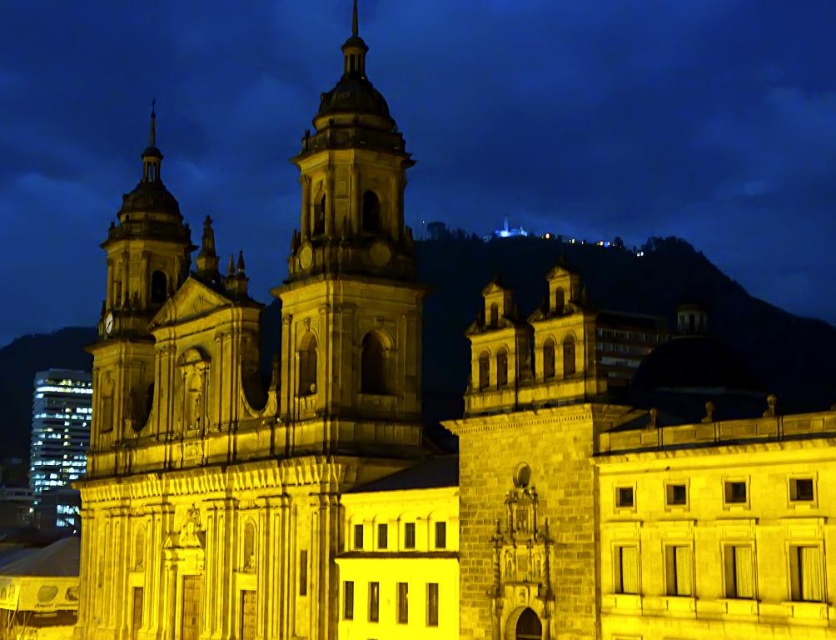
Question: Which point is closer to the camera?

Choices:
 (A) (317, 378)
 (B) (136, 291)

Answer: (A)

Question: Which point is closer to the camera?

Choices:
 (A) matte stone bell tower at center
 (B) white stone tower at center

Answer: (B)

Question: Does white stone tower at center lie in front of matte stone bell tower at center?

Choices:
 (A) yes
 (B) no

Answer: (A)

Question: Where is white stone tower at center located in relation to matte stone bell tower at center in the image?

Choices:
 (A) right
 (B) left

Answer: (B)

Question: In this image, where is white stone tower at center located relative to matte stone bell tower at center?

Choices:
 (A) above
 (B) below

Answer: (B)

Question: Which of the following is the farthest from the observer?

Choices:
 (A) matte stone bell tower at center
 (B) white stone tower at center

Answer: (A)